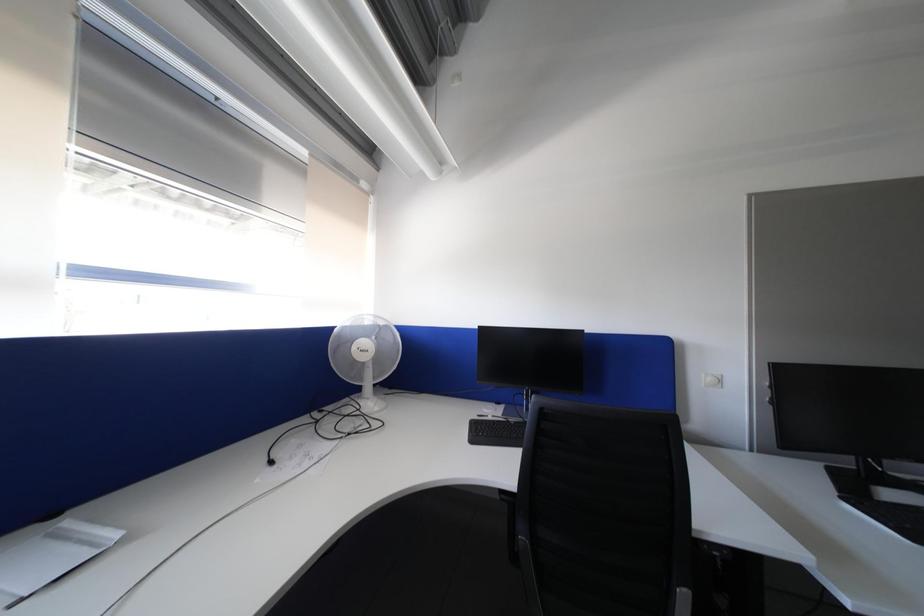
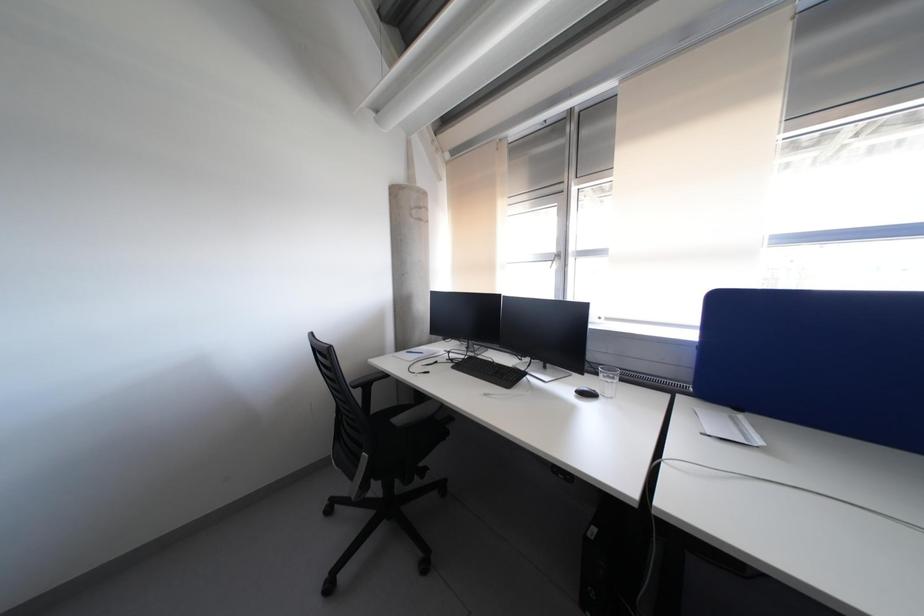
Question: The camera is either moving clockwise (left) or counter-clockwise (right) around the object. The first image is from the beginning of the video and the second image is from the end. Is the camera moving left or right when shooting the video?

Choices:
 (A) Left
 (B) Right

Answer: (B)